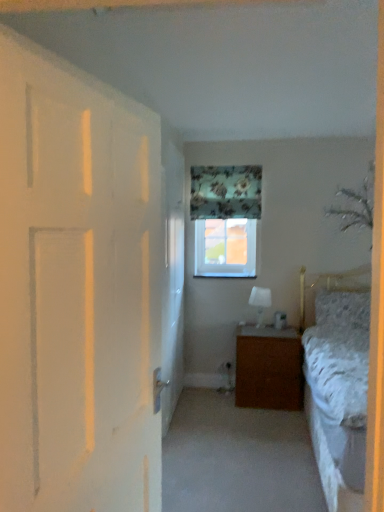
Question: From the image's perspective, is floral fabric curtain at upper center over white glossy lampshade at center?

Choices:
 (A) yes
 (B) no

Answer: (A)

Question: From a real-world perspective, is floral fabric curtain at upper center on top of white glossy lampshade at center?

Choices:
 (A) no
 (B) yes

Answer: (B)

Question: Is white glossy lampshade at center inside floral fabric curtain at upper center?

Choices:
 (A) yes
 (B) no

Answer: (B)

Question: Is floral fabric curtain at upper center not close to white glossy lampshade at center?

Choices:
 (A) yes
 (B) no

Answer: (B)

Question: Is floral fabric curtain at upper center wider than white glossy lampshade at center?

Choices:
 (A) no
 (B) yes

Answer: (A)

Question: From a real-world perspective, is floral fabric curtain at upper center below white glossy lampshade at center?

Choices:
 (A) yes
 (B) no

Answer: (B)

Question: Is white glossy lampshade at center not close to floral fabric curtain at upper center?

Choices:
 (A) no
 (B) yes

Answer: (A)

Question: Is white glossy lampshade at center beside floral fabric curtain at upper center?

Choices:
 (A) yes
 (B) no

Answer: (B)

Question: From the image's perspective, is white glossy lampshade at center located beneath floral fabric curtain at upper center?

Choices:
 (A) yes
 (B) no

Answer: (A)

Question: From a real-world perspective, is white glossy lampshade at center over floral fabric curtain at upper center?

Choices:
 (A) yes
 (B) no

Answer: (B)

Question: Is white glossy lampshade at center smaller than floral fabric curtain at upper center?

Choices:
 (A) yes
 (B) no

Answer: (A)

Question: Is white glossy lampshade at center outside floral fabric curtain at upper center?

Choices:
 (A) yes
 (B) no

Answer: (A)

Question: Is clear glass window at upper center looking in the opposite direction of fluffy white pillow at right?

Choices:
 (A) yes
 (B) no

Answer: (B)